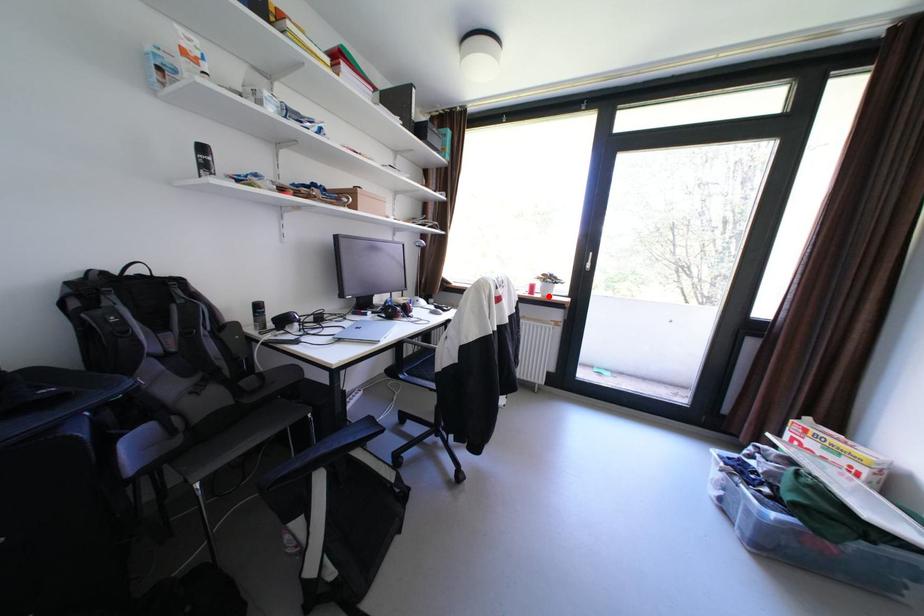
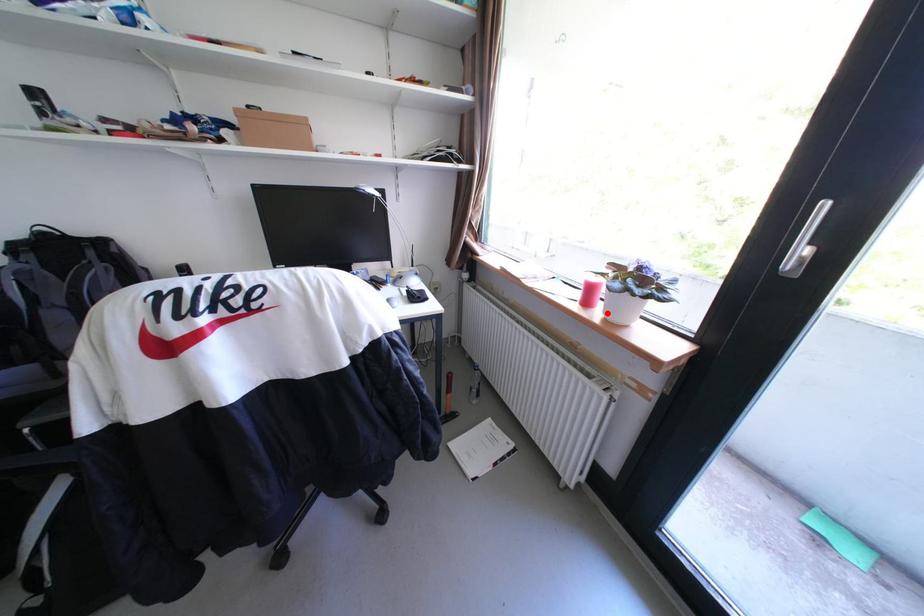
Based on the photo, I am providing you with two images of the same scene from different viewpoints. A red point is marked on the first image and another point is marked on the second image. Are the points marked in image1 and image2 representing the same 3D position?

Yes